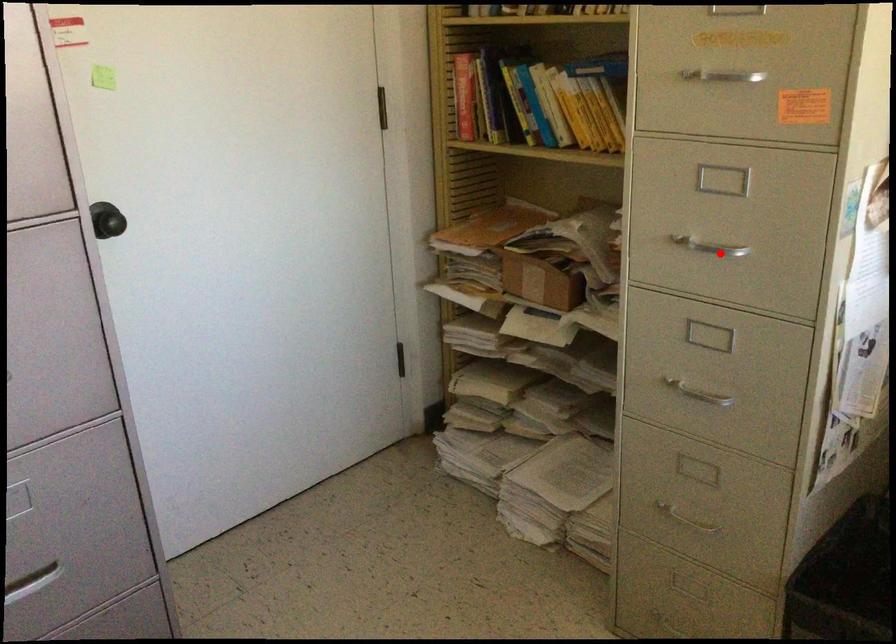
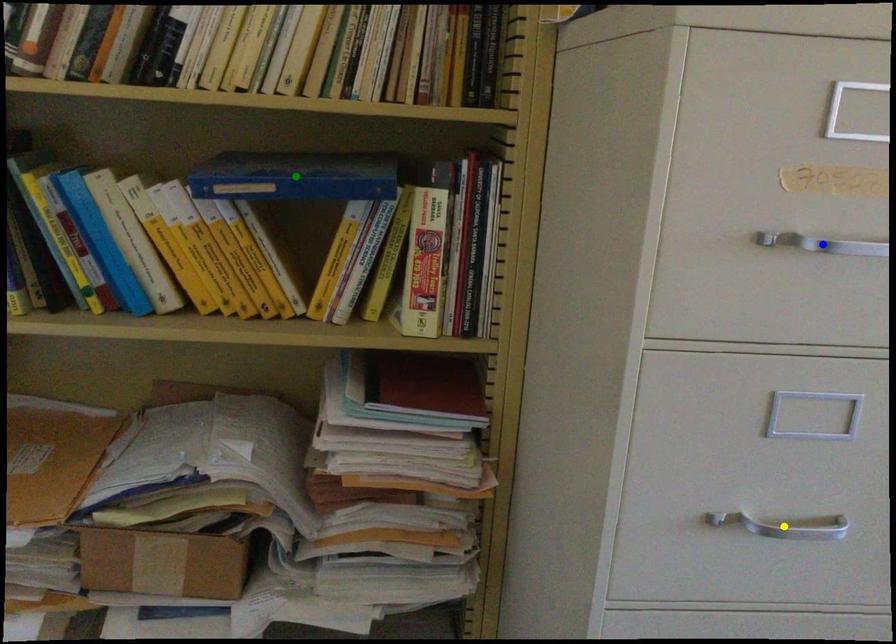
Question: I am providing you with two images of the same scene from different viewpoints. A red point is marked on the first image. You are given multiple points on the second image. Which point in image 2 represents the same 3d spot as the red point in image 1?

Choices:
 (A) blue point
 (B) yellow point
 (C) green point

Answer: (B)